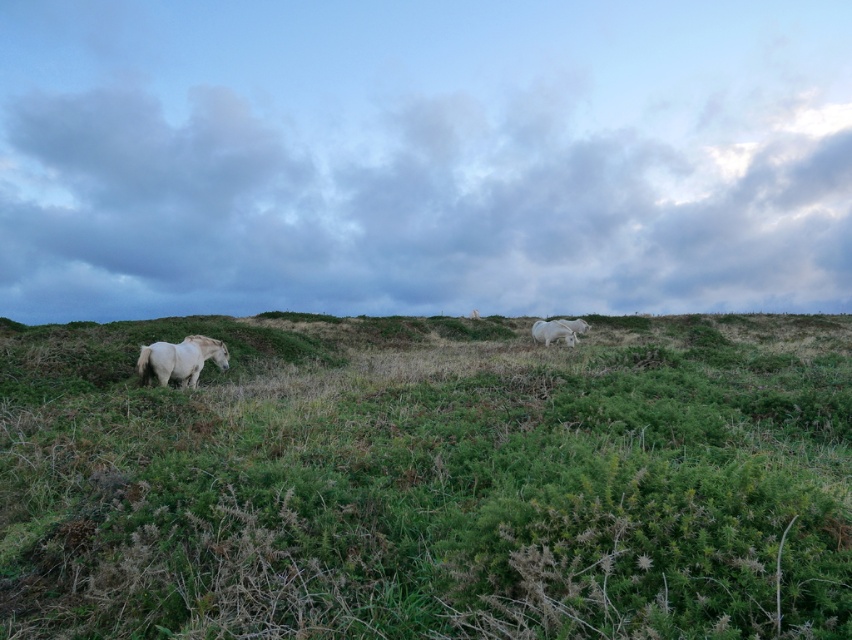
Does point (533, 333) lie in front of point (563, 323)?

No, it is behind (563, 323).

Who is lower down, white matte horse at upper center or white matte horse at center?

white matte horse at upper center

Who is more distant from viewer, (545, 342) or (573, 324)?

The point (573, 324) is more distant.

What are the coordinates of `white matte horse at upper center` in the screenshot? It's located at (551, 332).

Which is above, green grassy at center or white matte horse at center?

white matte horse at center

Who is more distant from viewer, (642, 429) or (585, 330)?

Point (585, 330)

The height and width of the screenshot is (640, 852). In order to click on green grassy at center in this screenshot , I will do `click(429, 480)`.

Where is `green grassy at center`? green grassy at center is located at coordinates (429, 480).

Measure the distance between point (154, 369) and camera.

11.48 meters

Where is `white matte horse at left`? white matte horse at left is located at coordinates 179,358.